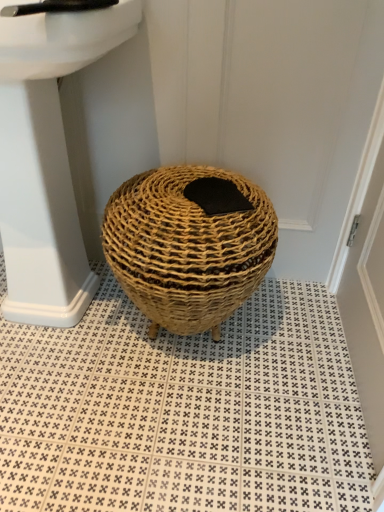
Locate an element on the screen. Image resolution: width=384 pixels, height=512 pixels. vacant region in front of natural woven basket at center is located at coordinates (175, 434).